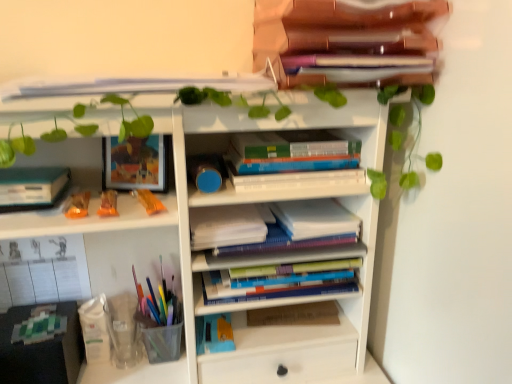
This screenshot has width=512, height=384. Identify the location of hardcover books at center, which is counted as the 1th book, starting from the bottom. (280, 281).

The height and width of the screenshot is (384, 512). What do you see at coordinates (295, 315) in the screenshot?
I see `hardcover book at center, which ranks as the second paperback book in right-to-left order` at bounding box center [295, 315].

The width and height of the screenshot is (512, 384). I want to click on hardcover books at center, acting as the third book starting from the top, so click(x=303, y=227).

Identify the location of white paper at center, the 3th paperback book positioned from the bottom. The image size is (512, 384). (314, 218).

At what (x,y) coordinates should I click in order to perform the action: click on hardcover books at center, which is counted as the 1th book, starting from the bottom. Please return your answer as a coordinate pair (x, y). Image resolution: width=512 pixels, height=384 pixels. Looking at the image, I should click on (280, 281).

Is translucent plastic pen holder at lower left next to white paper at center, acting as the 4th paperback book starting from the left, and touching it?

translucent plastic pen holder at lower left and white paper at center, acting as the 4th paperback book starting from the left, are not in contact.

Considering the positions of points (166, 288) and (325, 230), is point (166, 288) closer to camera compared to point (325, 230)?

No, (166, 288) is behind (325, 230).

How far apart are translucent plastic pen holder at lower left and white paper at center, which is the second paperback book from top to bottom?

The distance of translucent plastic pen holder at lower left from white paper at center, which is the second paperback book from top to bottom, is 14.56 inches.

From a real-world perspective, is translucent plastic pen holder at lower left located beneath white paper at center, the 3th paperback book positioned from the bottom?

Yes, from a real-world perspective, translucent plastic pen holder at lower left is beneath white paper at center, the 3th paperback book positioned from the bottom.

Is hardcover books at center, marked as the 2th book in a top-to-bottom arrangement, situated inside hardcover books at center, the 2th book when ordered from bottom to top, or outside?

The correct answer is: outside.

From a real-world perspective, which is physically below, hardcover books at center, marked as the 2th book in a top-to-bottom arrangement, or hardcover books at center, the 2th book when ordered from bottom to top?

hardcover books at center, the 2th book when ordered from bottom to top, from a real-world perspective.

Is point (329, 170) in front of point (331, 217)?

Yes.

Is translucent orange candy at left, the 3th toy viewed from the right, surrounded by translucent orange candy at left, the first toy positioned from the right?

No, translucent orange candy at left, the 3th toy viewed from the right, is not surrounded by translucent orange candy at left, the first toy positioned from the right.

Which is farther, [159,202] or [74,210]?

The point [159,202] is more distant.

From a real-world perspective, is translucent orange candy at left, marked as the 3th toy in a left-to-right arrangement, below translucent orange candy at left, which is the first toy from left to right?

Yes.

Is translucent orange candy at left, marked as the 3th toy in a left-to-right arrangement, at the left side of translucent orange candy at left, which is the first toy from left to right?

Incorrect, translucent orange candy at left, marked as the 3th toy in a left-to-right arrangement, is not on the left side of translucent orange candy at left, which is the first toy from left to right.

What are the coordinates of `stationery below the hardcover books at center, which appears as the third book when ordered from the bottom (from the image's perspective)` in the screenshot? It's located at (161, 322).

Does point (193, 140) come behind point (174, 325)?

No, (193, 140) is in front of (174, 325).

Between hardcover books at center, which appears as the third book when ordered from the bottom, and translucent plastic pen holder at lower left, which one has larger width?

Wider between the two is hardcover books at center, which appears as the third book when ordered from the bottom.

Between hardcover books at center, which appears as the third book when ordered from the bottom, and translucent plastic pen holder at lower left, which one appears on the right side from the viewer's perspective?

Positioned to the right is hardcover books at center, which appears as the third book when ordered from the bottom.

From a real-world perspective, is hardcover books at center, positioned as the fourth book in top-to-bottom order, on top of wooden folder at upper center, arranged as the 4th book when ordered from the bottom?

Incorrect, from a real-world perspective, hardcover books at center, positioned as the fourth book in top-to-bottom order, is lower than wooden folder at upper center, arranged as the 4th book when ordered from the bottom.

Is hardcover books at center, positioned as the fourth book in top-to-bottom order, facing towards wooden folder at upper center, the 1th book when ordered from top to bottom?

No, hardcover books at center, positioned as the fourth book in top-to-bottom order, does not turn towards wooden folder at upper center, the 1th book when ordered from top to bottom.

From the hardcover books at center, which is counted as the 1th book, starting from the bottom, count 3rd books forward and point to it. Please provide its 2D coordinates.

[(339, 32)]

Which is in front, hardcover books at center, positioned as the fourth book in top-to-bottom order, or wooden folder at upper center, arranged as the 4th book when ordered from the bottom?

wooden folder at upper center, arranged as the 4th book when ordered from the bottom, is in front.

At what (x,y) coordinates should I click in order to perform the action: click on the 3rd book counting from the right side of the white paper at center, marked as the second paperback book in a bottom-to-top arrangement. Please return your answer as a coordinate pair (x, y). Looking at the image, I should click on (288, 171).

How different are the orientations of white paper at center, which is the third paperback book from right to left, and hardcover books at center, which appears as the third book when ordered from the bottom, in degrees?

white paper at center, which is the third paperback book from right to left, and hardcover books at center, which appears as the third book when ordered from the bottom, are facing 0.197 degrees away from each other.

Can you see white paper at center, which is the second paperback book from left to right, touching hardcover books at center, which appears as the third book when ordered from the bottom?

No, white paper at center, which is the second paperback book from left to right, is not with hardcover books at center, which appears as the third book when ordered from the bottom.

Would you say hardcover books at center, marked as the 2th book in a top-to-bottom arrangement, is part of white paper at center, marked as the second paperback book in a bottom-to-top arrangement,'s contents?

Definitely not — hardcover books at center, marked as the 2th book in a top-to-bottom arrangement, is not inside white paper at center, marked as the second paperback book in a bottom-to-top arrangement.

Considering the relative positions of wooden folder at upper center, arranged as the 4th book when ordered from the bottom, and hardcover books at center, which is counted as the 1th book, starting from the bottom, in the image provided, is wooden folder at upper center, arranged as the 4th book when ordered from the bottom, to the right of hardcover books at center, which is counted as the 1th book, starting from the bottom, from the viewer's perspective?

Correct, you'll find wooden folder at upper center, arranged as the 4th book when ordered from the bottom, to the right of hardcover books at center, which is counted as the 1th book, starting from the bottom.

Who is bigger, wooden folder at upper center, arranged as the 4th book when ordered from the bottom, or hardcover books at center, positioned as the fourth book in top-to-bottom order?

With larger size is wooden folder at upper center, arranged as the 4th book when ordered from the bottom.

From a real-world perspective, is wooden folder at upper center, arranged as the 4th book when ordered from the bottom, positioned above or below hardcover books at center, which is counted as the 1th book, starting from the bottom?

wooden folder at upper center, arranged as the 4th book when ordered from the bottom, is above hardcover books at center, which is counted as the 1th book, starting from the bottom.

Is wooden folder at upper center, the 1th book when ordered from top to bottom, not within hardcover books at center, which is counted as the 1th book, starting from the bottom?

That's correct, wooden folder at upper center, the 1th book when ordered from top to bottom, is outside of hardcover books at center, which is counted as the 1th book, starting from the bottom.

Locate an element on the screen. stationery located on the left of white paper at center, acting as the 4th paperback book starting from the left is located at coordinates (161, 322).

You are a GUI agent. You are given a task and a screenshot of the screen. Output one action in this format:
    pyautogui.click(x=<x>, y=<y>)
    Task: Click on the 1st book positioned above the hardcover books at center, acting as the third book starting from the top (from the image's perspective)
    The width and height of the screenshot is (512, 384).
    Given the screenshot: What is the action you would take?
    pyautogui.click(x=288, y=171)

Estimate the real-world distances between objects in this image. Which object is closer to translucent orange candy at left, marked as the 3th toy in a left-to-right arrangement, hardcover book at center, positioned as the fourth paperback book in top-to-bottom order, or hardcover books at center, which is counted as the 1th book, starting from the bottom?

hardcover books at center, which is counted as the 1th book, starting from the bottom.

Based on their spatial positions, is translucent orange candy at left, marked as the 3th toy in a left-to-right arrangement, or translucent orange candy at left, which is the first toy from left to right, further from white paper at center, which is the second paperback book from left to right?

translucent orange candy at left, which is the first toy from left to right, is positioned further to the anchor white paper at center, which is the second paperback book from left to right.

Based on their spatial positions, is translucent orange toy at left, acting as the 2th toy starting from the right, or hardcover books at center, acting as the third book starting from the top, further from hardcover books at center, which is counted as the 1th book, starting from the bottom?

translucent orange toy at left, acting as the 2th toy starting from the right, is further to hardcover books at center, which is counted as the 1th book, starting from the bottom.

Estimate the real-world distances between objects in this image. Which object is further from translucent orange candy at left, the first toy positioned from the right, hardcover book at center, positioned as the fourth paperback book in top-to-bottom order, or translucent orange toy at left, the 2th toy when ordered from left to right?

Based on the image, hardcover book at center, positioned as the fourth paperback book in top-to-bottom order, appears to be further to translucent orange candy at left, the first toy positioned from the right.

Which object lies further to the anchor point translucent plastic pen holder at lower left, translucent orange candy at left, which is the first toy from left to right, or white paper at center, marked as the second paperback book in a bottom-to-top arrangement?

translucent orange candy at left, which is the first toy from left to right, is positioned further to the anchor translucent plastic pen holder at lower left.

Considering their positions, is hardcover book at left, the 1th paperback book from the top, positioned closer to translucent orange candy at left, marked as the 3th toy in a left-to-right arrangement, than wooden folder at upper center, arranged as the 4th book when ordered from the bottom?

hardcover book at left, the 1th paperback book from the top, is closer to translucent orange candy at left, marked as the 3th toy in a left-to-right arrangement.

Based on their spatial positions, is white paper at center, the 3th paperback book positioned from the bottom, or hardcover book at left, which is the fourth paperback book in right-to-left order, further from white paper at center, which is the third paperback book from right to left?

hardcover book at left, which is the fourth paperback book in right-to-left order, is positioned further to the anchor white paper at center, which is the third paperback book from right to left.

When comparing their distances from translucent orange candy at left, which is the first toy from left to right, does hardcover book at left, the 1th paperback book in the left-to-right sequence, or translucent orange toy at left, the 2th toy when ordered from left to right, seem closer?

Among the two, translucent orange toy at left, the 2th toy when ordered from left to right, is located nearer to translucent orange candy at left, which is the first toy from left to right.

Where is `toy located between translucent orange toy at left, the 2th toy when ordered from left to right, and hardcover book at center, which appears as the first paperback book when ordered from the bottom, in the left-right direction`? toy located between translucent orange toy at left, the 2th toy when ordered from left to right, and hardcover book at center, which appears as the first paperback book when ordered from the bottom, in the left-right direction is located at coordinates (149, 201).

Locate an element on the screen. shelf between wooden folder at upper center, arranged as the 4th book when ordered from the bottom, and hardcover books at center, acting as the third book starting from the top, from top to bottom is located at coordinates (227, 257).

The height and width of the screenshot is (384, 512). I want to click on toy between translucent orange toy at left, acting as the 2th toy starting from the right, and white paper at center, which is the second paperback book from top to bottom, so click(x=149, y=201).

You are a GUI agent. You are given a task and a screenshot of the screen. Output one action in this format:
    pyautogui.click(x=<x>, y=<y>)
    Task: Click on the paperback book between translucent orange toy at left, acting as the 2th toy starting from the right, and hardcover book at center, which ranks as the second paperback book in right-to-left order, from left to right
    
    Given the screenshot: What is the action you would take?
    pyautogui.click(x=225, y=226)